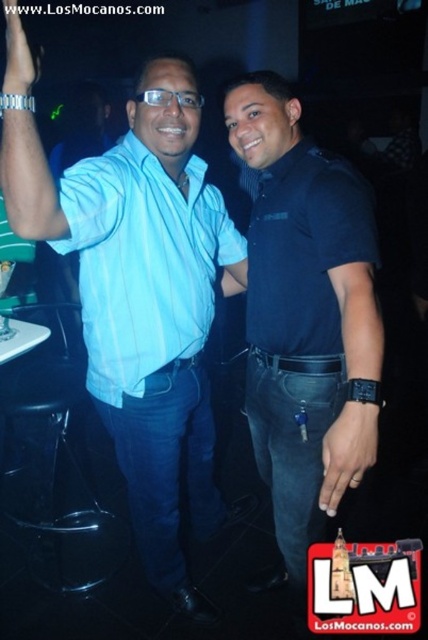
You are at the point with coordinates point (x=285, y=177) and want to move towards the exit located at point (x=118, y=339). Is there a clear path between these two points?

Point (x=285, y=177) is in front of point (x=118, y=339), so there is a clear path between them.

You are at a crowded event and want to take a photo of both the dark blue shirt at center and the light blue striped shirt at center. Which shirt should you zoom in on to ensure both fit in the frame?

The dark blue shirt at center has a lesser width compared to the light blue striped shirt at center, so you should zoom in on the light blue striped shirt at center to ensure both fit in the frame.

You are a photographer at a social event and need to ensure that all items in the photo are clearly visible. Given the dark blue shirt at center and the black leather watch at center, which item might be more challenging to capture clearly due to its size?

The black leather watch at center might be more challenging to capture clearly due to its smaller size compared to the dark blue shirt at center.